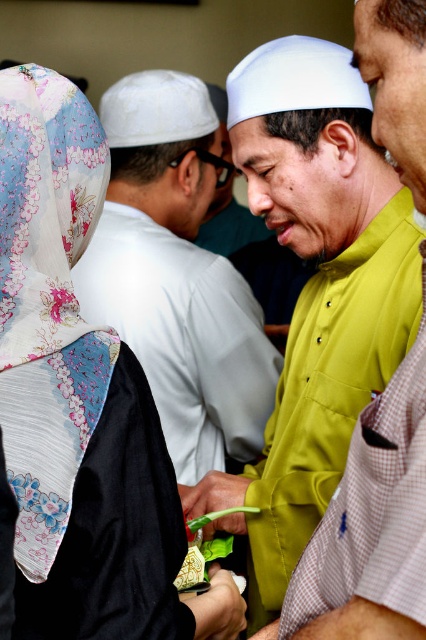
You are a photographer at the event and want to capture a photo that includes both the green matte shirt at center and the matte yellow shirt at center. Which shirt should you focus on first to ensure both are in the frame?

The green matte shirt at center is below the matte yellow shirt at center, so you should focus on the matte yellow shirt at center first to ensure both are in the frame.